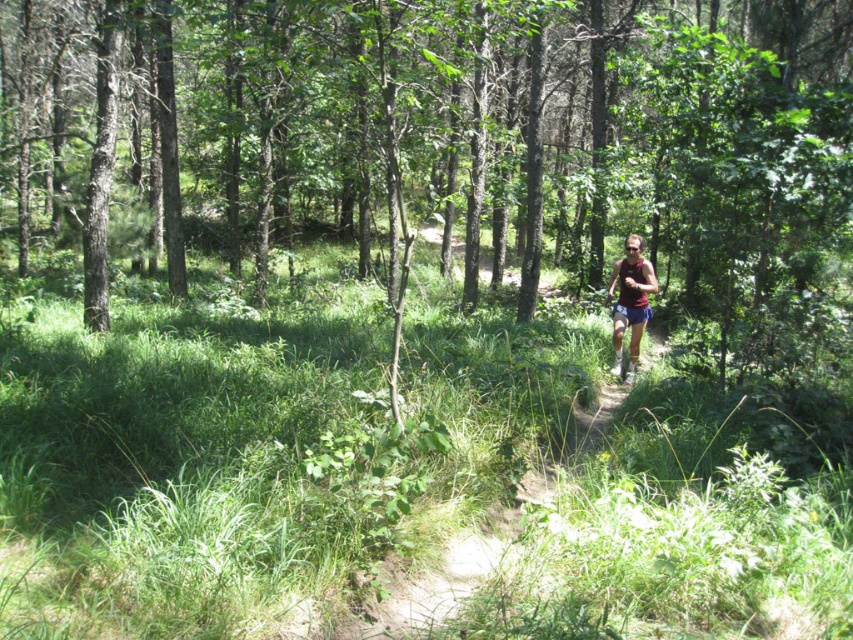
Between brown bark tree at center and maroon fabric shorts at center, which one has less height?

With less height is maroon fabric shorts at center.

I want to click on brown bark tree at center, so click(x=454, y=138).